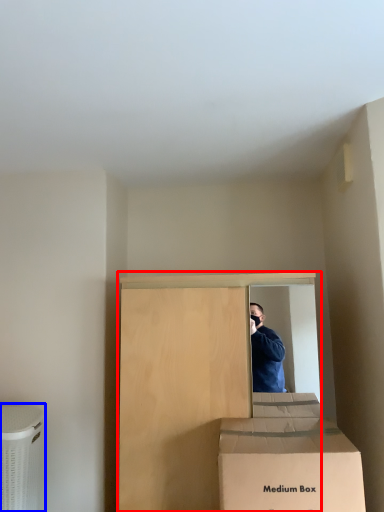
Question: Which object is closer to the camera taking this photo, furniture (highlighted by a red box) or cardboard box (highlighted by a blue box)?

Choices:
 (A) furniture
 (B) cardboard box

Answer: (A)